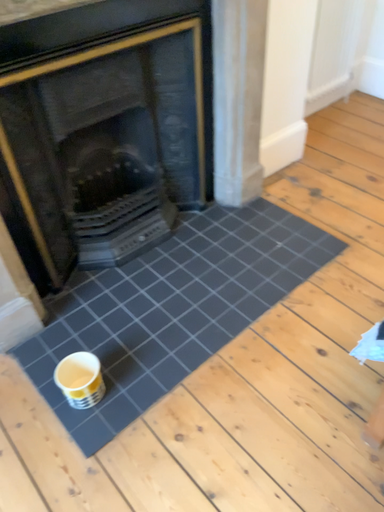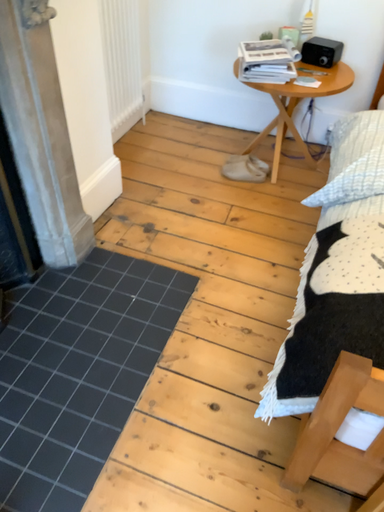
Question: How did the camera likely rotate when shooting the video?

Choices:
 (A) rotated right
 (B) rotated left

Answer: (A)